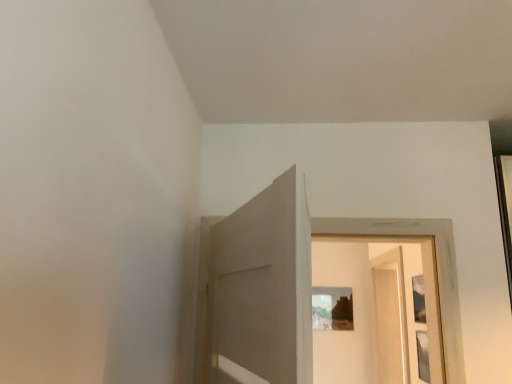
Question: Does matte wooden picture frame at center appear on the right side of clear glass screen door at center?

Choices:
 (A) no
 (B) yes

Answer: (A)

Question: Does matte wooden picture frame at center turn towards clear glass screen door at center?

Choices:
 (A) no
 (B) yes

Answer: (B)

Question: Can you confirm if matte wooden picture frame at center is wider than clear glass screen door at center?

Choices:
 (A) yes
 (B) no

Answer: (B)

Question: From a real-world perspective, is matte wooden picture frame at center physically below clear glass screen door at center?

Choices:
 (A) no
 (B) yes

Answer: (A)

Question: Is matte wooden picture frame at center thinner than clear glass screen door at center?

Choices:
 (A) no
 (B) yes

Answer: (B)

Question: Considering the relative sizes of matte wooden picture frame at center and clear glass screen door at center in the image provided, is matte wooden picture frame at center shorter than clear glass screen door at center?

Choices:
 (A) yes
 (B) no

Answer: (A)

Question: Does clear glass screen door at center have a lesser height compared to matte wooden picture frame at center?

Choices:
 (A) yes
 (B) no

Answer: (B)

Question: Is clear glass screen door at center with matte wooden picture frame at center?

Choices:
 (A) no
 (B) yes

Answer: (A)

Question: Can you confirm if clear glass screen door at center is wider than matte wooden picture frame at center?

Choices:
 (A) no
 (B) yes

Answer: (B)

Question: Is matte wooden picture frame at center at the back of clear glass screen door at center?

Choices:
 (A) no
 (B) yes

Answer: (A)

Question: Is clear glass screen door at center positioned in front of matte wooden picture frame at center?

Choices:
 (A) yes
 (B) no

Answer: (A)

Question: Does clear glass screen door at center have a larger size compared to matte wooden picture frame at center?

Choices:
 (A) yes
 (B) no

Answer: (A)

Question: Considering their positions, is matte wooden picture frame at center located in front of or behind clear glass screen door at center?

Choices:
 (A) front
 (B) behind

Answer: (B)